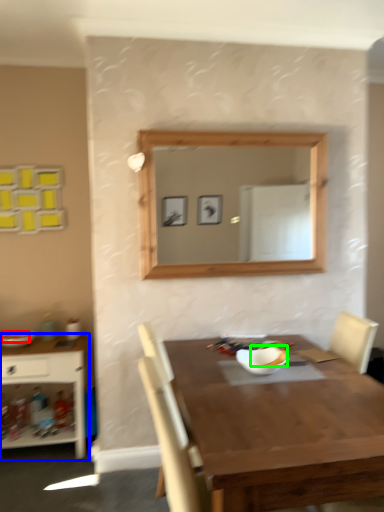
Question: Considering the real-world distances, which object is farthest from food (highlighted by a red box)? shelf (highlighted by a blue box) or food (highlighted by a green box)?

Choices:
 (A) shelf
 (B) food

Answer: (B)